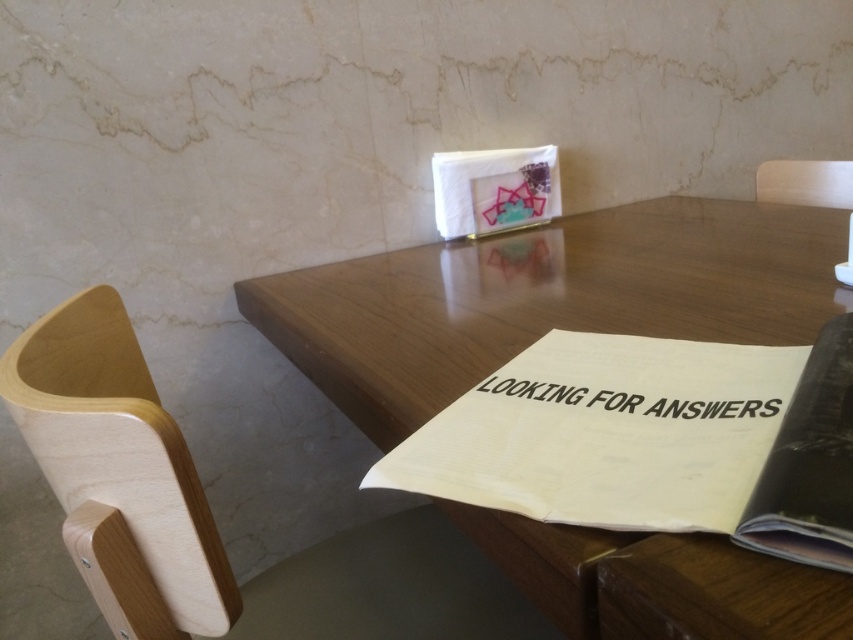
Question: Which point is closer to the camera?

Choices:
 (A) (553, 481)
 (B) (534, 257)

Answer: (A)

Question: Does white paper book at center have a greater width compared to light wood chair at lower left?

Choices:
 (A) no
 (B) yes

Answer: (A)

Question: Which point is farther to the camera?

Choices:
 (A) pos(772,403)
 (B) pos(115,435)

Answer: (A)

Question: Can you confirm if light wood chair at lower left is positioned above black paper at center?

Choices:
 (A) no
 (B) yes

Answer: (A)

Question: Which point appears farthest from the camera in this image?

Choices:
 (A) (521, 428)
 (B) (350, 621)
 (C) (810, 198)
 (D) (428, 310)

Answer: (C)

Question: Can you confirm if wooden table at center is bigger than wooden chair at upper right?

Choices:
 (A) no
 (B) yes

Answer: (B)